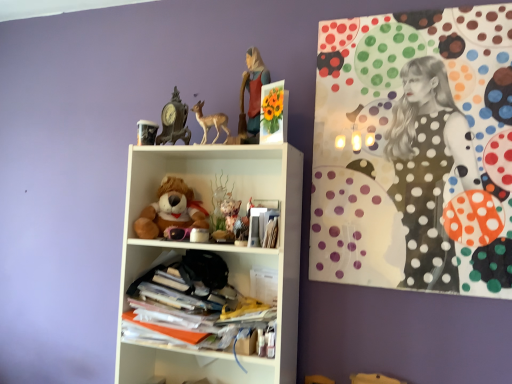
At what (x,y) coordinates should I click in order to perform the action: click on free point to the right of antique bronze clock at upper center. Please return your answer as a coordinate pair (x, y). This screenshot has width=512, height=384. Looking at the image, I should click on (222, 152).